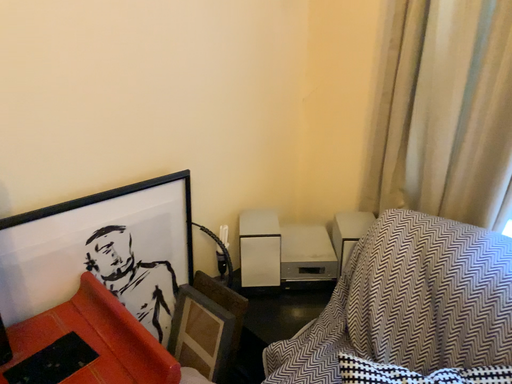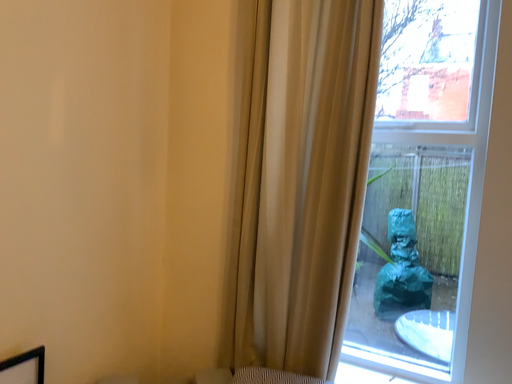
Question: How did the camera likely rotate when shooting the video?

Choices:
 (A) rotated downward
 (B) rotated upward

Answer: (B)